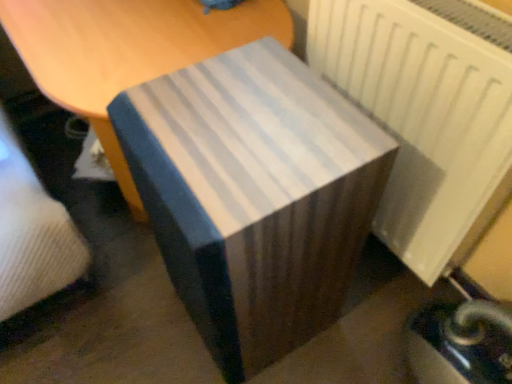
The height and width of the screenshot is (384, 512). Identify the location of vacant region to the left of blue striped fabric at center. (137, 314).